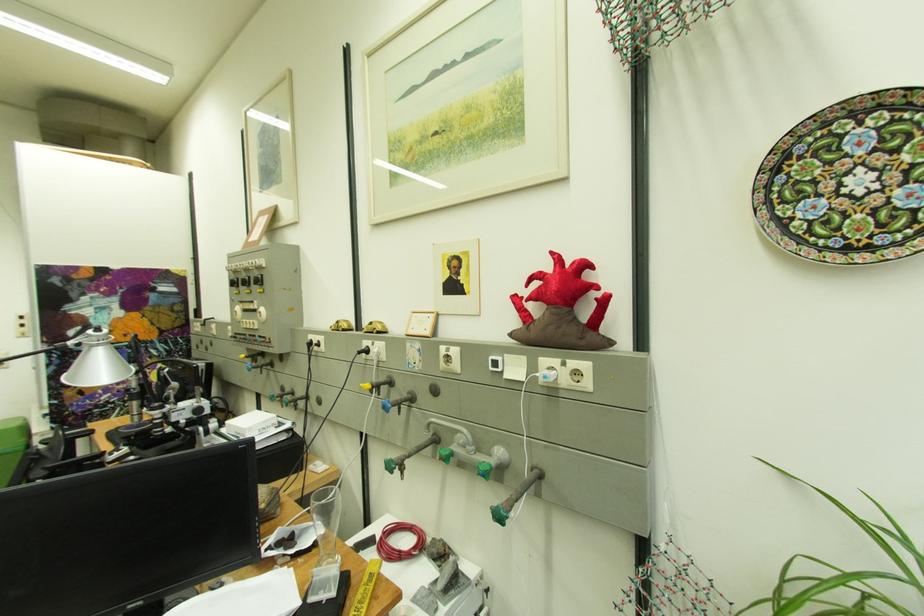
Where would you turn the white control dial? Please return your answer as a coordinate pair (x, y).

(448, 359)